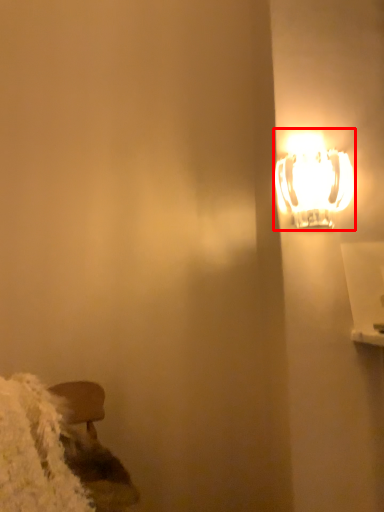
Question: From the image's perspective, what is the correct spatial positioning of lamp (annotated by the red box) in reference to wide?

Choices:
 (A) above
 (B) below

Answer: (A)